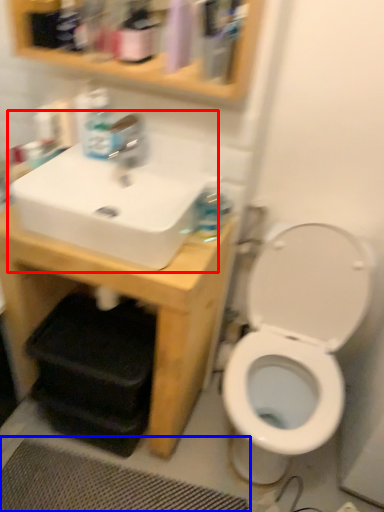
Question: Which object is closer to the camera taking this photo, sink (highlighted by a red box) or bath mat (highlighted by a blue box)?

Choices:
 (A) sink
 (B) bath mat

Answer: (A)